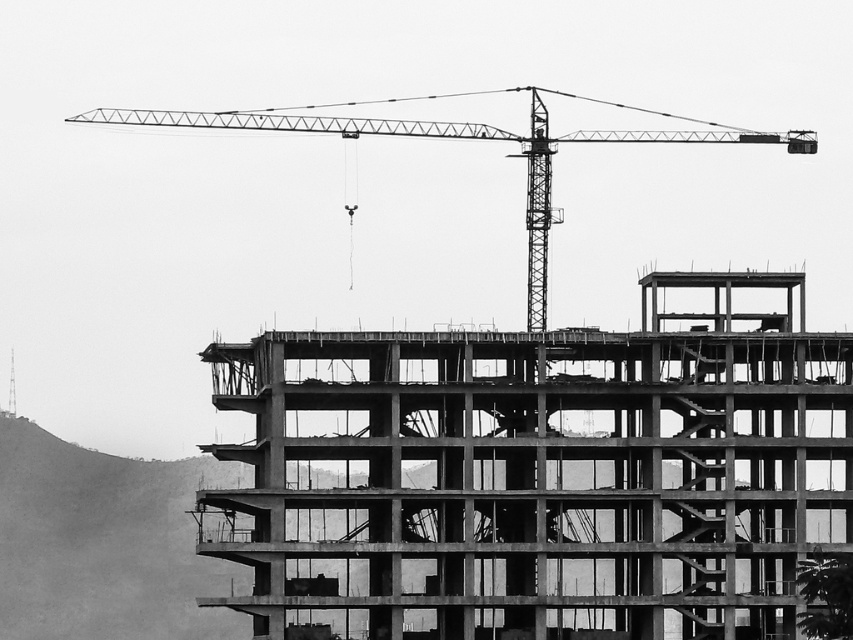
Question: Is concrete at center below metallic construction crane at upper center?

Choices:
 (A) yes
 (B) no

Answer: (A)

Question: Is concrete at center to the right of metallic construction crane at upper center from the viewer's perspective?

Choices:
 (A) yes
 (B) no

Answer: (A)

Question: Does concrete at center lie behind metallic construction crane at upper center?

Choices:
 (A) yes
 (B) no

Answer: (B)

Question: Which object appears farthest from the camera in this image?

Choices:
 (A) metallic construction crane at upper center
 (B) concrete at center

Answer: (A)